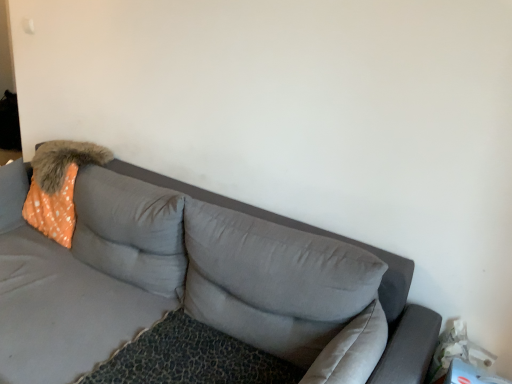
What do you see at coordinates (194, 286) in the screenshot?
I see `gray fabric couch at center` at bounding box center [194, 286].

What is the approximate height of orange dotted fabric pillow at upper left, arranged as the first pillow when viewed from the left?

It is 43.25 centimeters.

Locate an element on the screen. orange dotted fabric pillow at upper left, arranged as the first pillow when viewed from the left is located at coordinates (130, 230).

Image resolution: width=512 pixels, height=384 pixels. What do you see at coordinates (58, 186) in the screenshot?
I see `orange dotted fabric at left` at bounding box center [58, 186].

The height and width of the screenshot is (384, 512). I want to click on gray fabric pillow at center, which is counted as the first pillow, starting from the right, so click(273, 281).

At what (x,y) coordinates should I click in order to perform the action: click on pillow behind the gray fabric pillow at center, which is counted as the first pillow, starting from the right. Please return your answer as a coordinate pair (x, y). This screenshot has width=512, height=384. Looking at the image, I should click on (130, 230).

From a real-world perspective, is orange dotted fabric pillow at upper left, which is counted as the second pillow, starting from the right, physically below gray fabric pillow at center, which is counted as the first pillow, starting from the right?

Correct, in the physical world, orange dotted fabric pillow at upper left, which is counted as the second pillow, starting from the right, is lower than gray fabric pillow at center, which is counted as the first pillow, starting from the right.

Considering their positions, is orange dotted fabric pillow at upper left, which is counted as the second pillow, starting from the right, located in front of or behind gray fabric pillow at center, which is counted as the 2th pillow, starting from the left?

In the image, orange dotted fabric pillow at upper left, which is counted as the second pillow, starting from the right, appears behind gray fabric pillow at center, which is counted as the 2th pillow, starting from the left.

Is orange dotted fabric pillow at upper left, arranged as the first pillow when viewed from the left, placed right next to gray fabric pillow at center, which is counted as the 2th pillow, starting from the left?

They are not placed beside each other.

From the image's perspective, is orange dotted fabric at left located above or below gray fabric pillow at center, which is counted as the first pillow, starting from the right?

orange dotted fabric at left is situated higher than gray fabric pillow at center, which is counted as the first pillow, starting from the right, in the image.

Between point (46, 155) and point (334, 281), which one is positioned behind?

Positioned behind is point (46, 155).

Does orange dotted fabric at left touch gray fabric pillow at center, which is counted as the first pillow, starting from the right?

No, orange dotted fabric at left is not touching gray fabric pillow at center, which is counted as the first pillow, starting from the right.

Considering the relative sizes of gray fabric pillow at center, which is counted as the first pillow, starting from the right, and orange dotted fabric pillow at upper left, which is counted as the second pillow, starting from the right, in the image provided, is gray fabric pillow at center, which is counted as the first pillow, starting from the right, thinner than orange dotted fabric pillow at upper left, which is counted as the second pillow, starting from the right,?

Yes, gray fabric pillow at center, which is counted as the first pillow, starting from the right, is thinner than orange dotted fabric pillow at upper left, which is counted as the second pillow, starting from the right.

Considering the sizes of gray fabric pillow at center, which is counted as the first pillow, starting from the right, and orange dotted fabric pillow at upper left, which is counted as the second pillow, starting from the right, in the image, is gray fabric pillow at center, which is counted as the first pillow, starting from the right, bigger or smaller than orange dotted fabric pillow at upper left, which is counted as the second pillow, starting from the right,?

gray fabric pillow at center, which is counted as the first pillow, starting from the right, is bigger than orange dotted fabric pillow at upper left, which is counted as the second pillow, starting from the right.

You are a GUI agent. You are given a task and a screenshot of the screen. Output one action in this format:
    pyautogui.click(x=<x>, y=<y>)
    Task: Click on the pillow behind the gray fabric pillow at center, which is counted as the first pillow, starting from the right
    
    Given the screenshot: What is the action you would take?
    pyautogui.click(x=130, y=230)

From a real-world perspective, does gray fabric pillow at center, which is counted as the 2th pillow, starting from the left, stand above orange dotted fabric pillow at upper left, arranged as the first pillow when viewed from the left?

Yes, from a real-world perspective, gray fabric pillow at center, which is counted as the 2th pillow, starting from the left, is on top of orange dotted fabric pillow at upper left, arranged as the first pillow when viewed from the left.

Considering the sizes of objects gray fabric pillow at center, which is counted as the first pillow, starting from the right, and orange dotted fabric at left in the image provided, who is taller, gray fabric pillow at center, which is counted as the first pillow, starting from the right, or orange dotted fabric at left?

orange dotted fabric at left.

Looking at this image, is gray fabric pillow at center, which is counted as the first pillow, starting from the right, smaller than orange dotted fabric at left?

Incorrect, gray fabric pillow at center, which is counted as the first pillow, starting from the right, is not smaller in size than orange dotted fabric at left.

From a real-world perspective, is gray fabric couch at center positioned above or below gray fabric pillow at center, which is counted as the first pillow, starting from the right?

In terms of real-world spatial position, gray fabric couch at center is below gray fabric pillow at center, which is counted as the first pillow, starting from the right.

Where is `studio couch to the left of gray fabric pillow at center, which is counted as the 2th pillow, starting from the left`? The image size is (512, 384). studio couch to the left of gray fabric pillow at center, which is counted as the 2th pillow, starting from the left is located at coordinates (194, 286).

How many degrees apart are the facing directions of gray fabric couch at center and gray fabric pillow at center, which is counted as the first pillow, starting from the right?

The angle between the facing direction of gray fabric couch at center and the facing direction of gray fabric pillow at center, which is counted as the first pillow, starting from the right, is 0.346 degrees.

Which of these two, gray fabric couch at center or gray fabric pillow at center, which is counted as the first pillow, starting from the right, is wider?

gray fabric couch at center.

Is point (40, 147) positioned after point (124, 223)?

Yes, point (40, 147) is farther from viewer.

From a real-world perspective, is orange dotted fabric at left beneath orange dotted fabric pillow at upper left, arranged as the first pillow when viewed from the left?

Yes, from a real-world perspective, orange dotted fabric at left is under orange dotted fabric pillow at upper left, arranged as the first pillow when viewed from the left.

Looking at the image, does orange dotted fabric at left seem bigger or smaller compared to orange dotted fabric pillow at upper left, arranged as the first pillow when viewed from the left?

In the image, orange dotted fabric at left appears to be larger than orange dotted fabric pillow at upper left, arranged as the first pillow when viewed from the left.

Visually, is orange dotted fabric pillow at upper left, which is counted as the second pillow, starting from the right, positioned to the left or to the right of orange dotted fabric at left?

Based on their positions, orange dotted fabric pillow at upper left, which is counted as the second pillow, starting from the right, is located to the right of orange dotted fabric at left.

Can you tell me how much orange dotted fabric pillow at upper left, arranged as the first pillow when viewed from the left, and orange dotted fabric at left differ in facing direction?

5.26 degrees separate the facing orientations of orange dotted fabric pillow at upper left, arranged as the first pillow when viewed from the left, and orange dotted fabric at left.

From a real-world perspective, which is physically below, orange dotted fabric pillow at upper left, arranged as the first pillow when viewed from the left, or orange dotted fabric at left?

In real-world perspective, orange dotted fabric at left is lower.

Find the location of `pillow to the right of orange dotted fabric pillow at upper left, arranged as the first pillow when viewed from the left`. pillow to the right of orange dotted fabric pillow at upper left, arranged as the first pillow when viewed from the left is located at coordinates (273, 281).

The height and width of the screenshot is (384, 512). Find the location of `pillow that is the 2nd object located below the orange dotted fabric at left (from the image's perspective)`. pillow that is the 2nd object located below the orange dotted fabric at left (from the image's perspective) is located at coordinates (273, 281).

From the image, which object appears to be farther from orange dotted fabric pillow at upper left, arranged as the first pillow when viewed from the left, gray fabric pillow at center, which is counted as the first pillow, starting from the right, or gray fabric couch at center?

gray fabric pillow at center, which is counted as the first pillow, starting from the right, lies further to orange dotted fabric pillow at upper left, arranged as the first pillow when viewed from the left, than the other object.

Considering their positions, is orange dotted fabric at left positioned further to gray fabric pillow at center, which is counted as the 2th pillow, starting from the left, than gray fabric couch at center?

orange dotted fabric at left is further to gray fabric pillow at center, which is counted as the 2th pillow, starting from the left.

Based on their spatial positions, is orange dotted fabric pillow at upper left, which is counted as the second pillow, starting from the right, or gray fabric pillow at center, which is counted as the first pillow, starting from the right, further from gray fabric couch at center?

Based on the image, gray fabric pillow at center, which is counted as the first pillow, starting from the right, appears to be further to gray fabric couch at center.

Which object lies nearer to the anchor point gray fabric pillow at center, which is counted as the 2th pillow, starting from the left, orange dotted fabric pillow at upper left, arranged as the first pillow when viewed from the left, or gray fabric couch at center?

gray fabric couch at center.

Looking at the image, which one is located further to orange dotted fabric pillow at upper left, arranged as the first pillow when viewed from the left, gray fabric couch at center or gray fabric pillow at center, which is counted as the first pillow, starting from the right?

Among the two, gray fabric pillow at center, which is counted as the first pillow, starting from the right, is located further to orange dotted fabric pillow at upper left, arranged as the first pillow when viewed from the left.

Based on their spatial positions, is gray fabric pillow at center, which is counted as the first pillow, starting from the right, or gray fabric couch at center closer to orange dotted fabric at left?

Among the two, gray fabric couch at center is located nearer to orange dotted fabric at left.

When comparing their distances from orange dotted fabric at left, does gray fabric couch at center or gray fabric pillow at center, which is counted as the 2th pillow, starting from the left, seem further?

gray fabric pillow at center, which is counted as the 2th pillow, starting from the left, lies further to orange dotted fabric at left than the other object.

Based on the photo, from the image, which object appears to be farther from gray fabric pillow at center, which is counted as the first pillow, starting from the right, gray fabric couch at center or orange dotted fabric at left?

The object further to gray fabric pillow at center, which is counted as the first pillow, starting from the right, is orange dotted fabric at left.

Find the location of `pillow located between gray fabric couch at center and orange dotted fabric pillow at upper left, arranged as the first pillow when viewed from the left, in the depth direction`. pillow located between gray fabric couch at center and orange dotted fabric pillow at upper left, arranged as the first pillow when viewed from the left, in the depth direction is located at coordinates (273, 281).

What are the coordinates of `pillow between orange dotted fabric at left and gray fabric pillow at center, which is counted as the first pillow, starting from the right` in the screenshot? It's located at (130, 230).